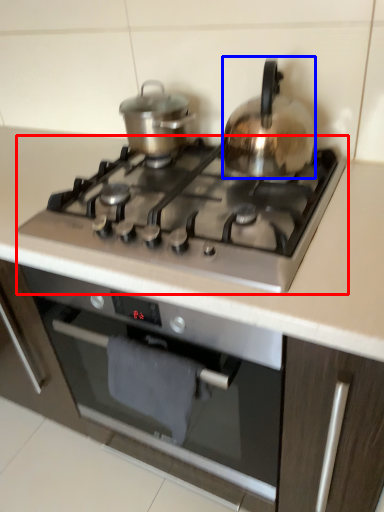
Question: Among these objects, which one is nearest to the camera, gas stove (highlighted by a red box) or kitchen appliance (highlighted by a blue box)?

Choices:
 (A) gas stove
 (B) kitchen appliance

Answer: (A)